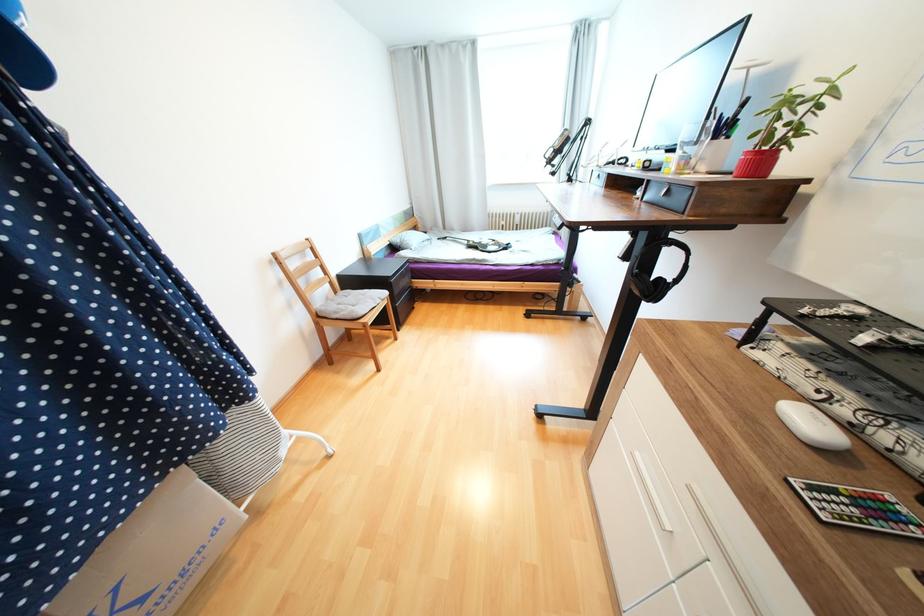
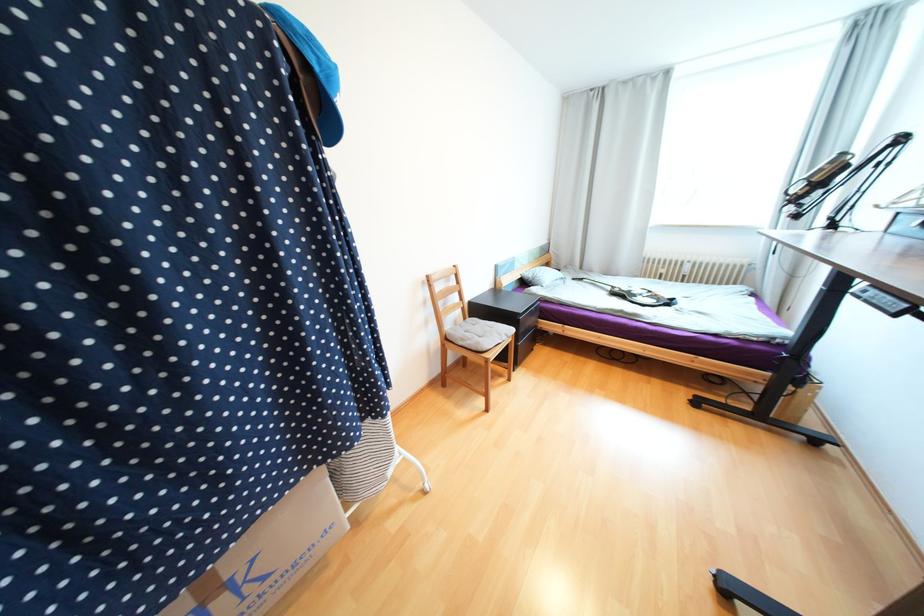
The images are taken continuously from a first-person perspective. In which direction are you moving?

The cameraman moved toward left, forward.